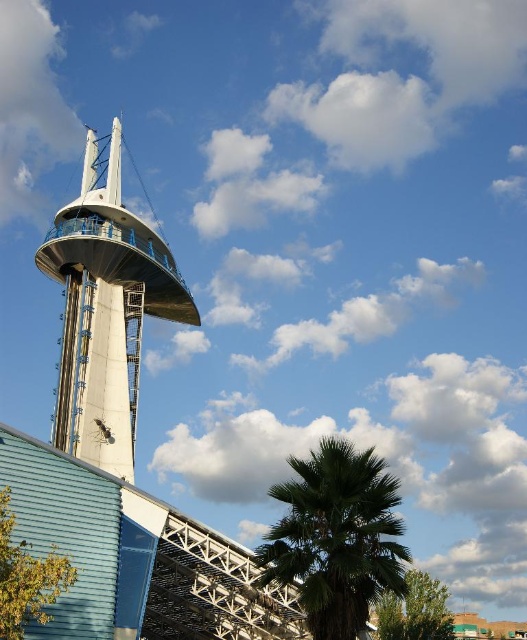
Which is above, concrete/smooth tower at center or green leafy palm at center?

concrete/smooth tower at center is higher up.

Can you confirm if concrete/smooth tower at center is smaller than green leafy palm at center?

Correct, concrete/smooth tower at center occupies less space than green leafy palm at center.

Measure the distance between concrete/smooth tower at center and camera.

75.73 meters

Where is `concrete/smooth tower at center`? concrete/smooth tower at center is located at coordinates (105, 310).